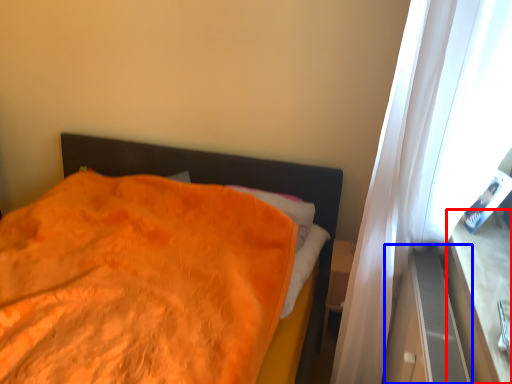
Question: Which object appears farthest to the camera in this image, window sill (highlighted by a red box) or dresser (highlighted by a blue box)?

Choices:
 (A) window sill
 (B) dresser

Answer: (B)